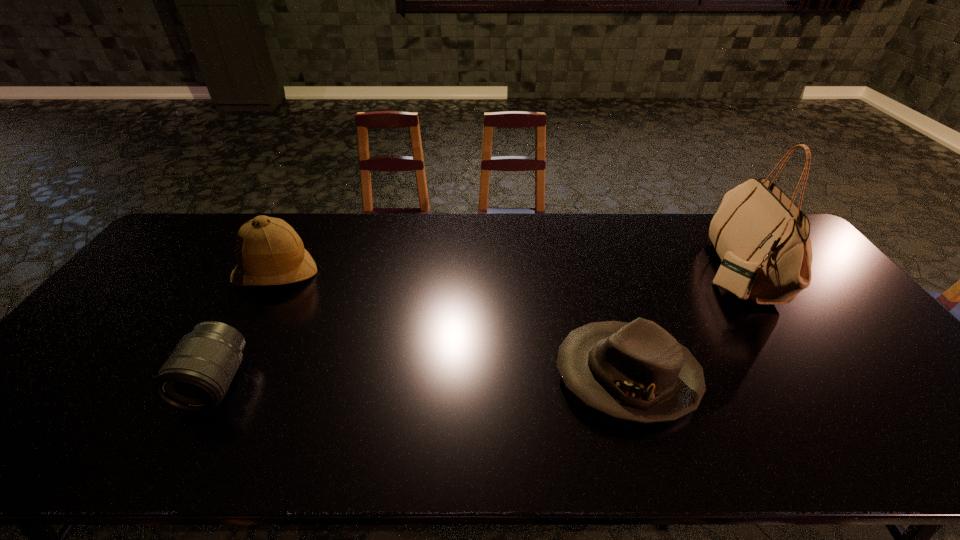
Locate an element on the screen. This screenshot has width=960, height=540. vacant point located between the right hat and the farther hat is located at coordinates (451, 325).

Image resolution: width=960 pixels, height=540 pixels. I want to click on vacant area between the taller hat and the rightmost object, so coord(506,272).

The image size is (960, 540). What are the coordinates of `vacant space that's between the telephoto lens and the taller hat` in the screenshot? It's located at (246, 328).

At what (x,y) coordinates should I click in order to perform the action: click on vacant area between the handbag and the farther hat. Please return your answer as a coordinate pair (x, y). The height and width of the screenshot is (540, 960). Looking at the image, I should click on (506, 272).

Where is `object that can be found as the third closest to the third shortest object`? This screenshot has width=960, height=540. object that can be found as the third closest to the third shortest object is located at coordinates (762, 237).

Locate which object ranks in proximity to the handbag. Please provide its 2D coordinates. Your answer should be formatted as a tuple, i.e. [(x, y)], where the tuple contains the x and y coordinates of a point satisfying the conditions above.

[(637, 371)]

Locate an element on the screen. The width and height of the screenshot is (960, 540). vacant area in the image that satisfies the following two spatial constraints: 1. on the side of the rightmost object with the attached pouch; 2. on the front-facing side of the taller hat is located at coordinates (737, 273).

Identify the location of free space that satisfies the following two spatial constraints: 1. on the decorative side of the shorter hat; 2. on the surface of the telephoto lens. (629, 382).

Find the location of a particular element. vacant position in the image that satisfies the following two spatial constraints: 1. on the decorative side of the right hat; 2. on the surface of the telephoto lens is located at coordinates (629, 382).

This screenshot has width=960, height=540. In order to click on vacant region that satisfies the following two spatial constraints: 1. on the side of the rightmost object with the attached pouch; 2. on the surface of the telephoto lens in this screenshot , I will do `click(810, 382)`.